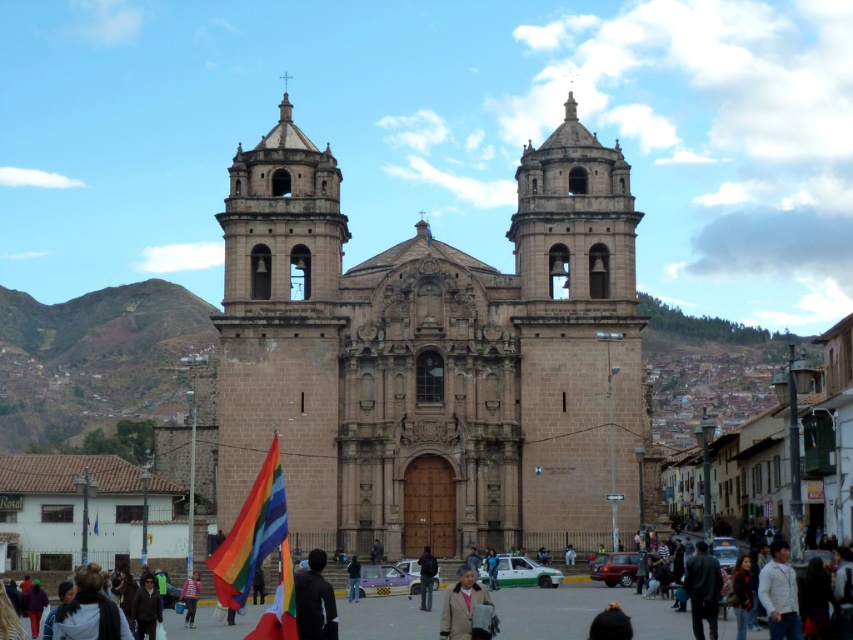
Question: Which is farther from the dark gray jacket at center?

Choices:
 (A) golden hair at lower center
 (B) brown stone church at center
 (C) dark blue jacket at lower left

Answer: (C)

Question: Which of the following is the closest to the observer?

Choices:
 (A) dark blue jacket at lower left
 (B) brown stone church at center
 (C) dark brown leather jacket at lower right
 (D) striped shirt at center

Answer: (A)

Question: Which point appears closest to the camera in this image?

Choices:
 (A) (525, 170)
 (B) (352, 557)
 (C) (769, 627)

Answer: (C)

Question: Does matte brown coat at lower center appear on the left side of striped shirt at center?

Choices:
 (A) yes
 (B) no

Answer: (B)

Question: Observing the image, what is the correct spatial positioning of golden hair at lower center in reference to striped shirt at center?

Choices:
 (A) right
 (B) left

Answer: (A)

Question: Is brown stone church at center bigger than striped shirt at center?

Choices:
 (A) no
 (B) yes

Answer: (B)